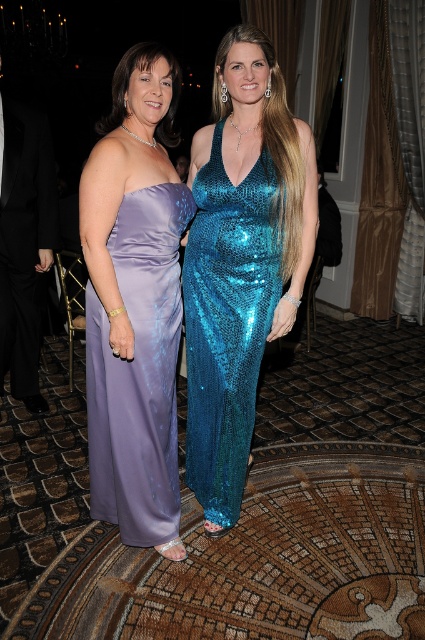
You are attending a formal event and see the two women described in the scene. There is a point marked at coordinates (138, 371). Which woman is wearing the satin dress located at that specific point?

The satin dress at center is located at point (138, 371), so the woman wearing it is the one positioned at that coordinate.

You are a photographer adjusting your camera focus. You need to focus on either the point at (155, 332) or the point at (235, 227). Which point should you choose to ensure the foreground subject is in focus?

You should focus on point (155, 332) because it is closer to the camera than point (235, 227), ensuring the foreground subject is in focus.

You are a photographer standing 1.5 meters away from the camera. You want to adjust your position so that you can clearly see the details of the satin dress at center. Should you move closer or farther away from the camera?

The satin dress at center is 1.82 meters away from the camera. Since you are currently 1.5 meters away from the camera, you are closer to the camera than the dress. To see the details of the satin dress at center clearly, you should move farther away from the camera to align your position with the dress.